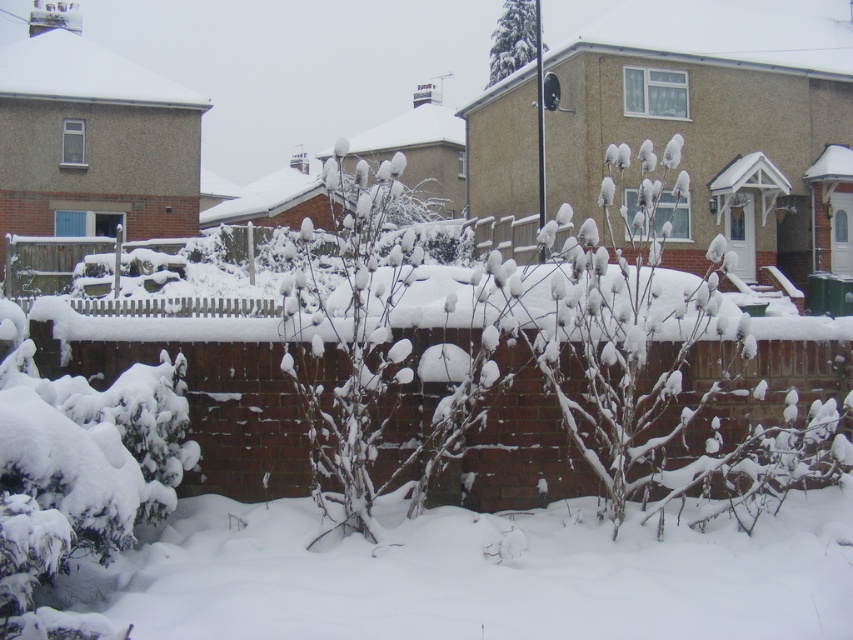
Does snow-covered bush at lower left have a larger size compared to green textured pine tree at upper center?

No.

Is snow-covered bush at lower left to the right of green textured pine tree at upper center from the viewer's perspective?

No, snow-covered bush at lower left is not to the right of green textured pine tree at upper center.

Describe the element at coordinates (78, 472) in the screenshot. The width and height of the screenshot is (853, 640). I see `snow-covered bush at lower left` at that location.

Locate an element on the screen. snow-covered bush at lower left is located at coordinates (78, 472).